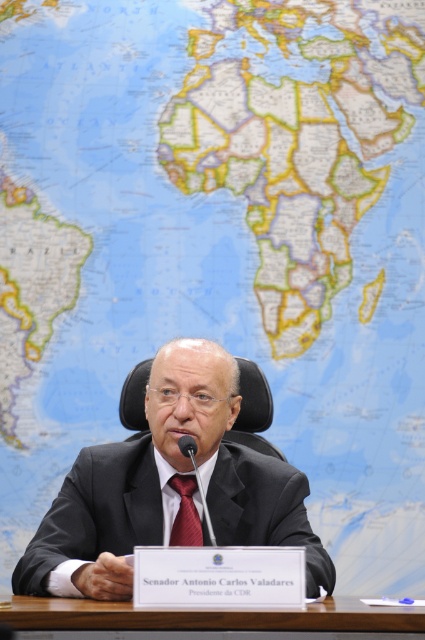
Question: Which point is closer to the camera?

Choices:
 (A) (96, 602)
 (B) (198, 532)

Answer: (A)

Question: Can you confirm if brown wooden table at center is thinner than matte black microphone at center?

Choices:
 (A) no
 (B) yes

Answer: (A)

Question: Which point appears closest to the camera in this image?

Choices:
 (A) (184, 445)
 (B) (195, 513)
 (C) (105, 609)

Answer: (C)

Question: Is the position of black suit at center less distant than that of red satin tie at center?

Choices:
 (A) yes
 (B) no

Answer: (A)

Question: Which of the following is the closest to the observer?

Choices:
 (A) red satin tie at center
 (B) black suit at center
 (C) black plastic microphone at center

Answer: (B)

Question: Does brown wooden table at center have a greater width compared to black plastic microphone at center?

Choices:
 (A) no
 (B) yes

Answer: (B)